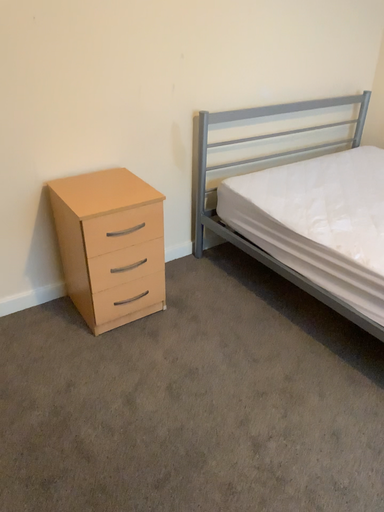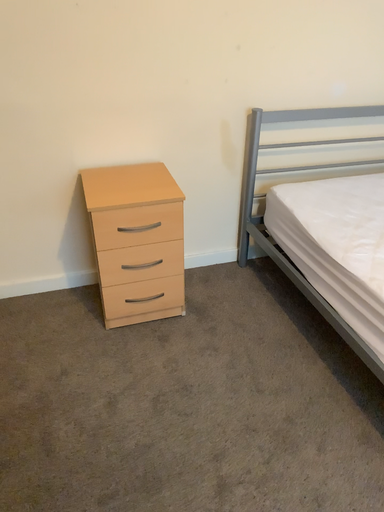
Question: How did the camera likely rotate when shooting the video?

Choices:
 (A) rotated left
 (B) rotated right

Answer: (A)